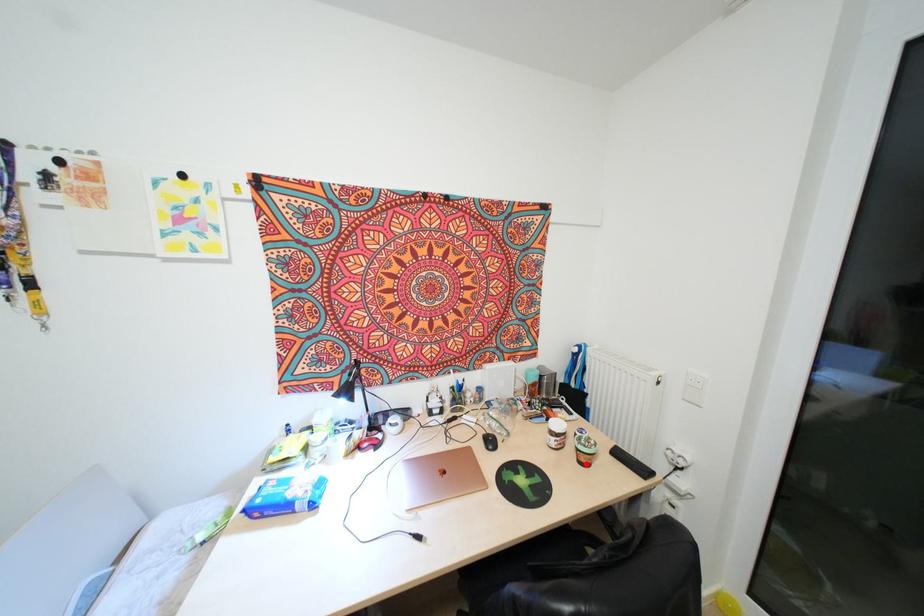
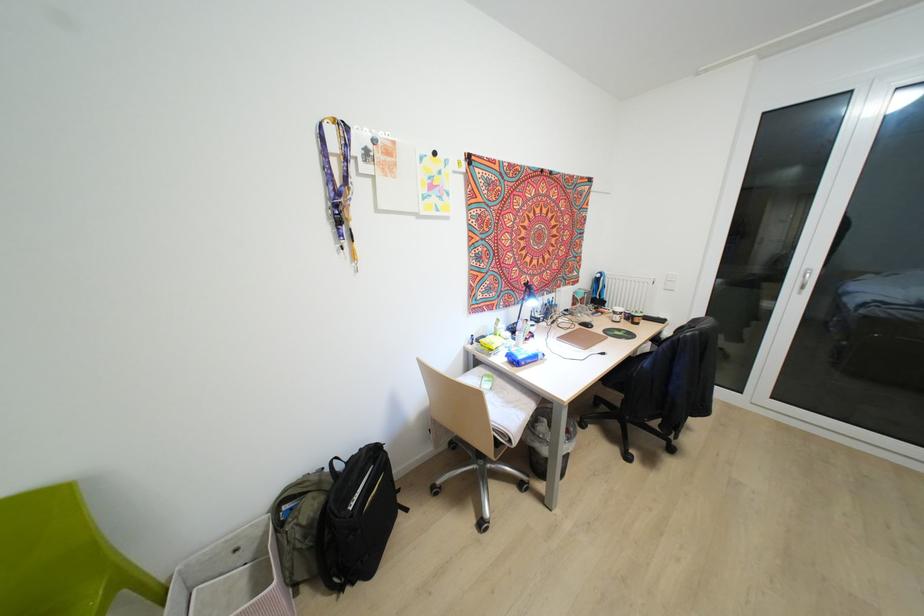
Find the pixel in the second image that matches the highlighted location in the first image.

(637, 323)